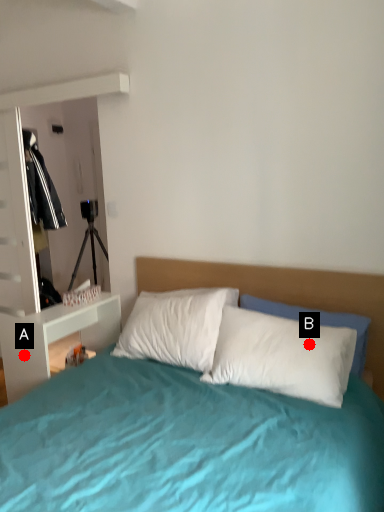
Question: Two points are circled on the image, labeled by A and B beside each circle. Which point appears closest to the camera in this image?

Choices:
 (A) A is closer
 (B) B is closer

Answer: (B)